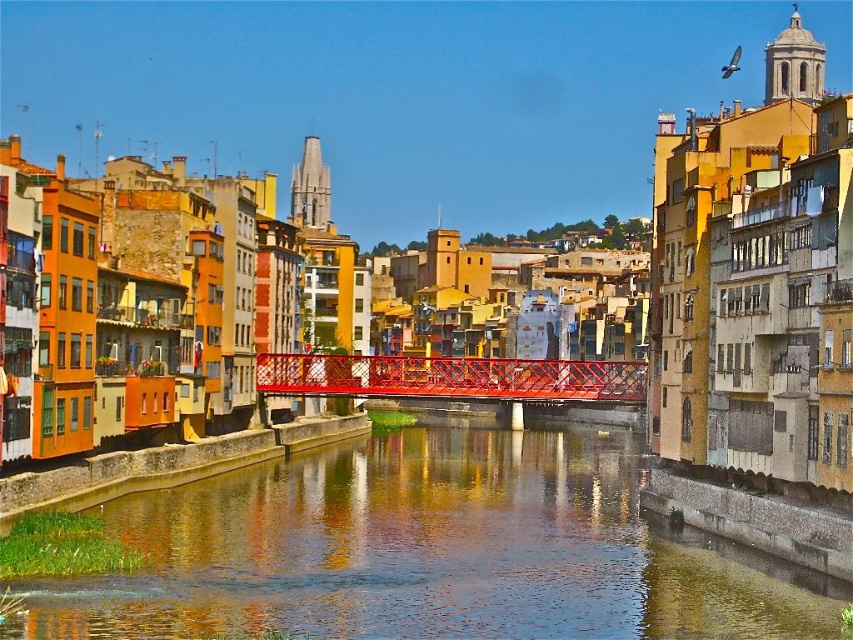
You are standing on the bank of the smooth concrete river at center and want to cross to the other side. The metallic red bridge at center is the only path available. Given that the bridge is 100 feet long, can you safely reach the other side without walking the entire length of the bridge?

The smooth concrete river at center is 93.69 feet away from the metallic red bridge at center. Since the bridge is 100 feet long, it is longer than the distance of the river, so yes, you can safely reach the other side without needing to walk the entire length of the bridge.

You are a city planner evaluating the space between the smooth concrete river at center and the metallic red bridge at center. If you want to install a 10 meter long decorative walkway between them, will there be enough space?

The smooth concrete river at center is narrower than the metallic red bridge at center, but the exact dimensions aren not provided. However, since the river is at the center and the bridge spans it, the bridge must be at least as wide as the river. The 10 meter walkway may fit if the bridge is wider, but without specific measurements, it is uncertain. The question cannot be definitively answered with the given information.